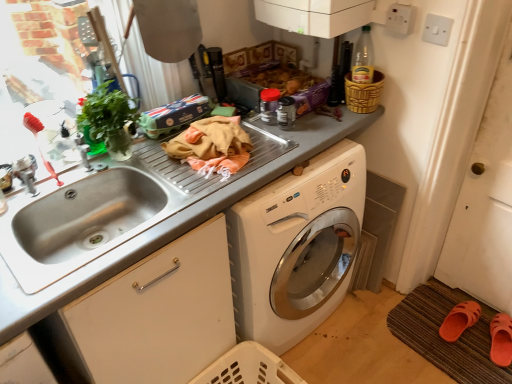
Locate an element on the screen. This screenshot has height=384, width=512. vacant point to the left of orange rubber slipper at lower right is located at coordinates (418, 327).